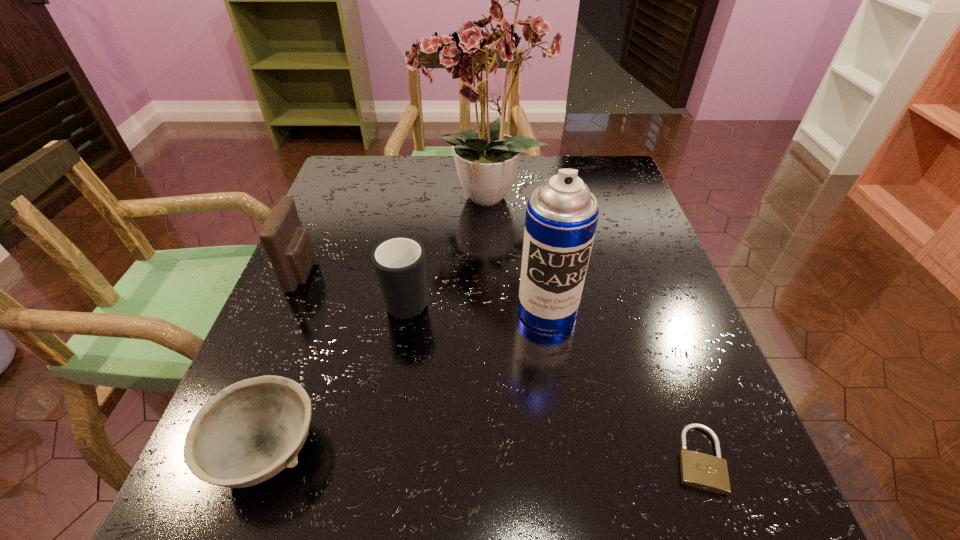
You are a GUI agent. You are given a task and a screenshot of the screen. Output one action in this format:
    pyautogui.click(x=<x>, y=<y>)
    Task: Click on the pouch that is at the left edge
    Image resolution: width=960 pixels, height=540 pixels.
    Given the screenshot: What is the action you would take?
    pyautogui.click(x=288, y=245)

Locate an element on the screen. The image size is (960, 540). bowl present at the left edge is located at coordinates (250, 431).

Find the location of `object at the right edge`. object at the right edge is located at coordinates (698, 470).

Find the location of a particular element. This screenshot has width=960, height=540. object at the near left corner is located at coordinates (250, 431).

Where is `object positioned at the near right corner`? This screenshot has width=960, height=540. object positioned at the near right corner is located at coordinates (698, 470).

The image size is (960, 540). In the image, there is a desktop. In order to click on vacant space at the far edge in this screenshot , I will do `click(524, 194)`.

Where is `free space at the left edge`? free space at the left edge is located at coordinates (356, 284).

Where is `free space at the right edge of the desktop`? free space at the right edge of the desktop is located at coordinates (675, 420).

The image size is (960, 540). I want to click on free space at the far right corner of the desktop, so click(596, 163).

Identify the location of vacant space at the near right corner of the desktop. The width and height of the screenshot is (960, 540). (729, 526).